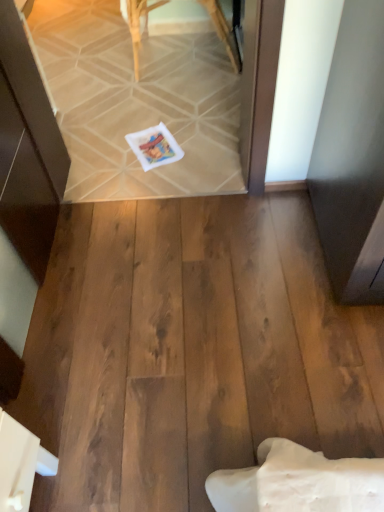
Question: Considering the positions of wooden chair at upper center and white matte postcard at center in the image, is wooden chair at upper center taller or shorter than white matte postcard at center?

Choices:
 (A) tall
 (B) short

Answer: (A)

Question: Considering their positions, is wooden chair at upper center located in front of or behind white matte postcard at center?

Choices:
 (A) behind
 (B) front

Answer: (A)

Question: In terms of size, does wooden chair at upper center appear bigger or smaller than white matte postcard at center?

Choices:
 (A) big
 (B) small

Answer: (A)

Question: From a real-world perspective, is white matte postcard at center above or below wooden chair at upper center?

Choices:
 (A) above
 (B) below

Answer: (B)

Question: From their relative heights in the image, would you say white matte postcard at center is taller or shorter than wooden chair at upper center?

Choices:
 (A) tall
 (B) short

Answer: (B)

Question: Considering their positions, is white matte postcard at center located in front of or behind wooden chair at upper center?

Choices:
 (A) front
 (B) behind

Answer: (A)

Question: Which is correct: white matte postcard at center is inside wooden chair at upper center, or outside of it?

Choices:
 (A) outside
 (B) inside

Answer: (A)